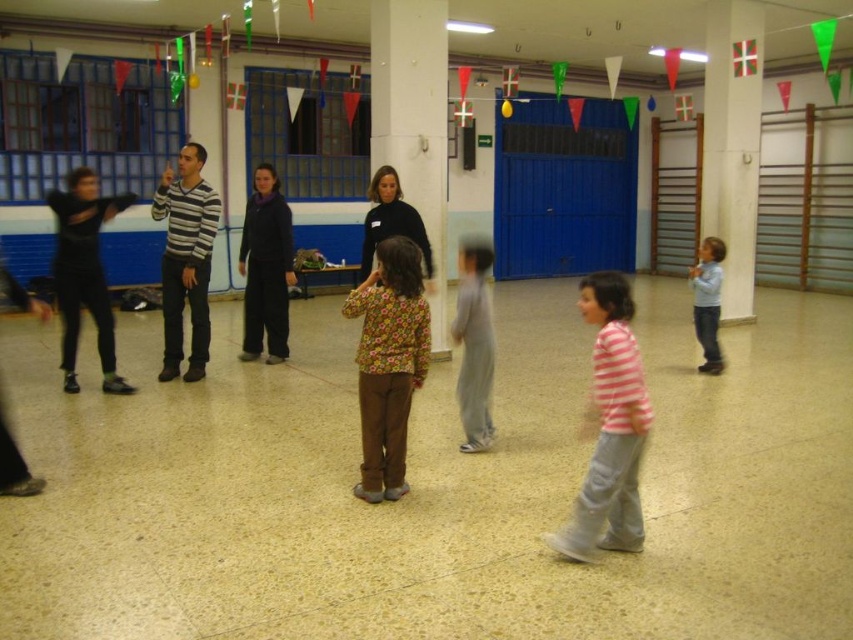
You are an event planner setting up a photo shoot in the dance class hall. You want to position a camera so it captures both the white glossy pillar at center and the floral fabric shirt at center. Since the pillar is above the shirt, where should you place the camera relative to the shirt to ensure both are in frame?

Since the white glossy pillar at center is located above the floral fabric shirt at center, you should position the camera at a lower angle facing upwards to capture both objects in the frame.

You are organizing a small event in the hall and need to place a 1.2 meter wide table. You have space between the white concrete pillar at right and the striped sweater at center. Will the table fit in that space?

The white concrete pillar at right is wider than the striped sweater at center. However, the question is about the space between them, not their widths. Without specific distance information between the two objects, we cannot determine if the table will fit. Please provide more details about the distance between the white concrete pillar at right and the striped sweater at center.